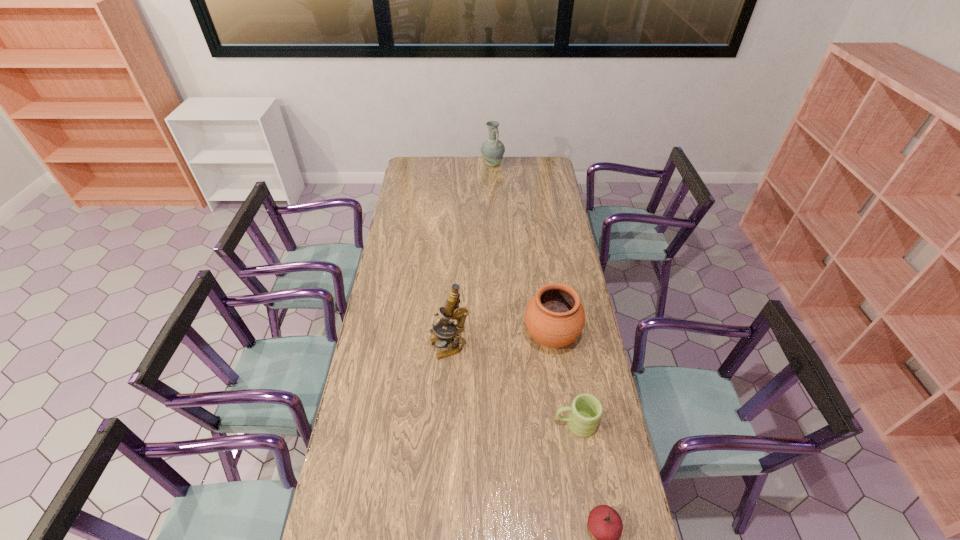
Find the location of a particular element. microscope is located at coordinates (x=451, y=311).

This screenshot has width=960, height=540. I want to click on the tallest object, so click(451, 311).

Locate an element on the screen. This screenshot has height=540, width=960. the second object from left to right is located at coordinates (492, 150).

You are a GUI agent. You are given a task and a screenshot of the screen. Output one action in this format:
    pyautogui.click(x=<x>, y=<y>)
    Task: Click on the farthest object
    The height and width of the screenshot is (540, 960).
    Given the screenshot: What is the action you would take?
    pyautogui.click(x=492, y=150)

Locate an element on the screen. pottery is located at coordinates (554, 317).

Image resolution: width=960 pixels, height=540 pixels. Find the location of `the second nearest object`. the second nearest object is located at coordinates (586, 410).

Identify the location of mug. The height and width of the screenshot is (540, 960). (586, 410).

Where is `free space located 0.290m on the right of the leftmost object`? The image size is (960, 540). free space located 0.290m on the right of the leftmost object is located at coordinates (542, 347).

Where is `vacant region located on the handle side of the farthest object`? The height and width of the screenshot is (540, 960). vacant region located on the handle side of the farthest object is located at coordinates (494, 203).

Locate an element on the screen. This screenshot has height=540, width=960. free location located 0.090m on the front of the pottery is located at coordinates [558, 381].